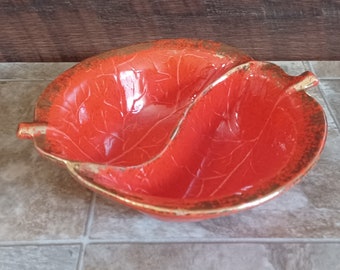
You are a GUI agent. You are given a task and a screenshot of the screen. Output one action in this format:
    pyautogui.click(x=<x>, y=<y>)
    Task: Click on the bowl
    Image resolution: width=340 pixels, height=270 pixels.
    Given the screenshot: What is the action you would take?
    pyautogui.click(x=210, y=154)